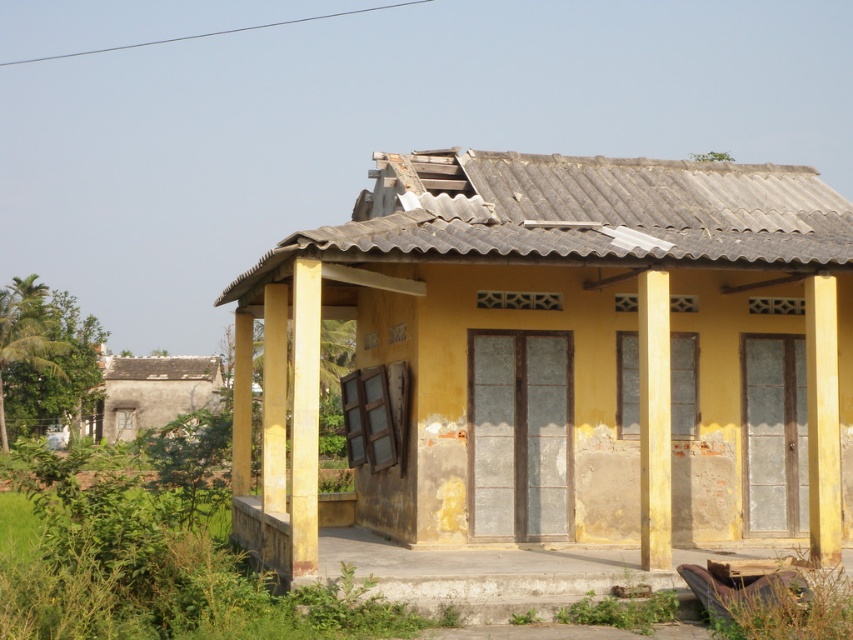
Which is in front, point (299, 260) or point (277, 312)?

Positioned in front is point (299, 260).

Which is in front, point (294, 525) or point (281, 394)?

Point (294, 525) is more forward.

This screenshot has width=853, height=640. Identify the location of yellow matte column at center. (305, 417).

Who is lower down, yellow painted wood porch at center or yellow matte/rough pillar at right?

Positioned lower is yellow painted wood porch at center.

Who is more distant from viewer, (502,600) or (834,358)?

The point (834,358) is more distant.

Locate an element on the screen. yellow painted wood porch at center is located at coordinates (476, 570).

Does yellow matte wood pillar at center appear over yellow painted wood at center?

Yes, yellow matte wood pillar at center is above yellow painted wood at center.

Does yellow matte wood pillar at center have a greater height compared to yellow painted wood at center?

No, yellow matte wood pillar at center is not taller than yellow painted wood at center.

Is point (656, 371) closer to viewer compared to point (247, 458)?

Yes, point (656, 371) is in front of point (247, 458).

Where is `yellow matte wood pillar at center`? The image size is (853, 640). yellow matte wood pillar at center is located at coordinates (654, 419).